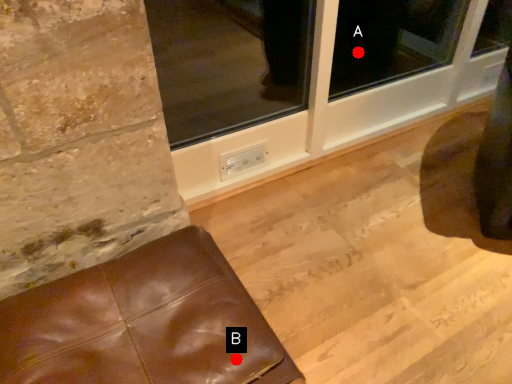
Question: Two points are circled on the image, labeled by A and B beside each circle. Among these points, which one is farthest from the camera?

Choices:
 (A) A is further
 (B) B is further

Answer: (A)